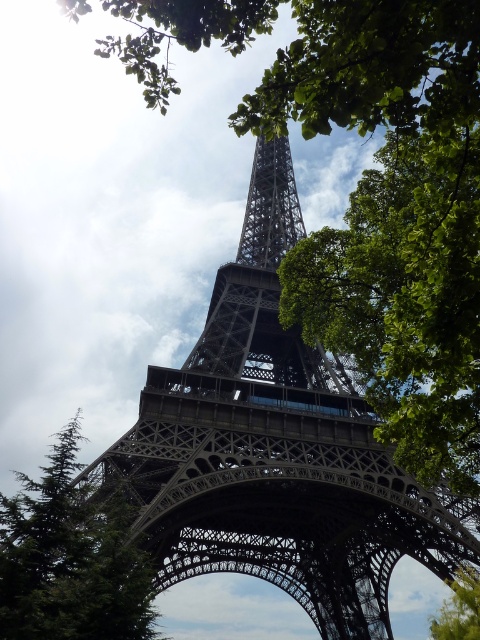
Is point (380, 244) positioned after point (456, 621)?

No, (380, 244) is in front of (456, 621).

Is green leafy tree at center to the left of green leafy tree at lower right from the viewer's perspective?

Correct, you'll find green leafy tree at center to the left of green leafy tree at lower right.

Does point (307, 240) come farther from viewer compared to point (456, 580)?

That is False.

The height and width of the screenshot is (640, 480). Find the location of `green leafy tree at center`. green leafy tree at center is located at coordinates (405, 298).

Where is `metallic lattice tower at center`? metallic lattice tower at center is located at coordinates (276, 449).

In the scene shown: Who is shorter, metallic lattice tower at center or green leafy tree at center?

With less height is green leafy tree at center.

What do you see at coordinates (276, 449) in the screenshot? The width and height of the screenshot is (480, 640). I see `metallic lattice tower at center` at bounding box center [276, 449].

At what (x,y) coordinates should I click in order to perform the action: click on metallic lattice tower at center. Please return your answer as a coordinate pair (x, y). The image size is (480, 640). Looking at the image, I should click on click(x=276, y=449).

Is green leafy tree at center positioned behind green textured tree at lower left?

No, it is in front of green textured tree at lower left.

Does green leafy tree at center appear on the right side of green textured tree at lower left?

Indeed, green leafy tree at center is positioned on the right side of green textured tree at lower left.

Who is more distant from viewer, (328, 268) or (48, 548)?

Positioned behind is point (328, 268).

I want to click on green leafy tree at center, so click(x=405, y=298).